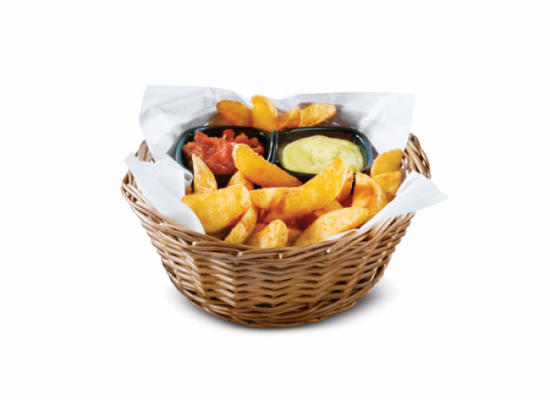
At what (x,y) coordinates should I click in order to perform the action: click on basket. Please return your answer as a coordinate pair (x, y). This screenshot has height=400, width=550. Looking at the image, I should click on (286, 279).